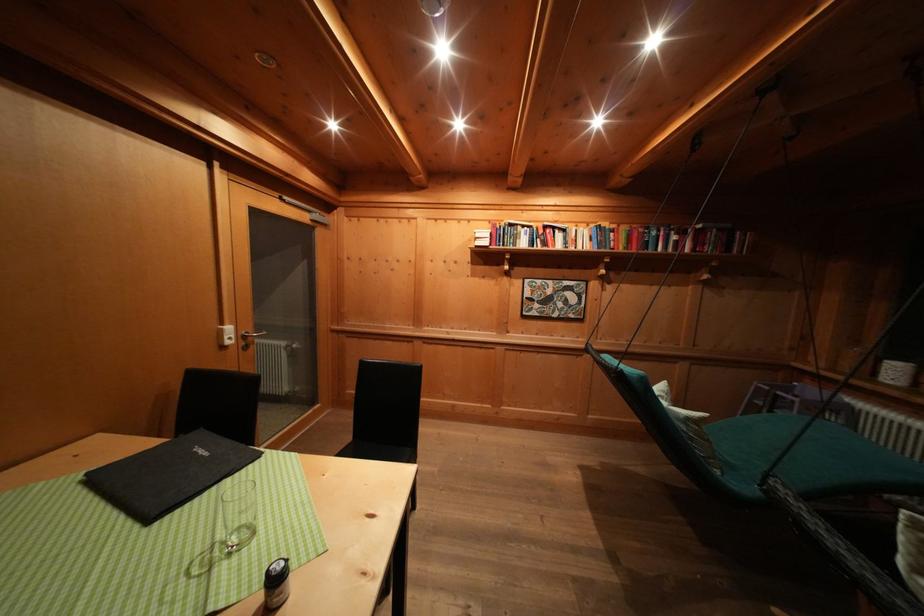
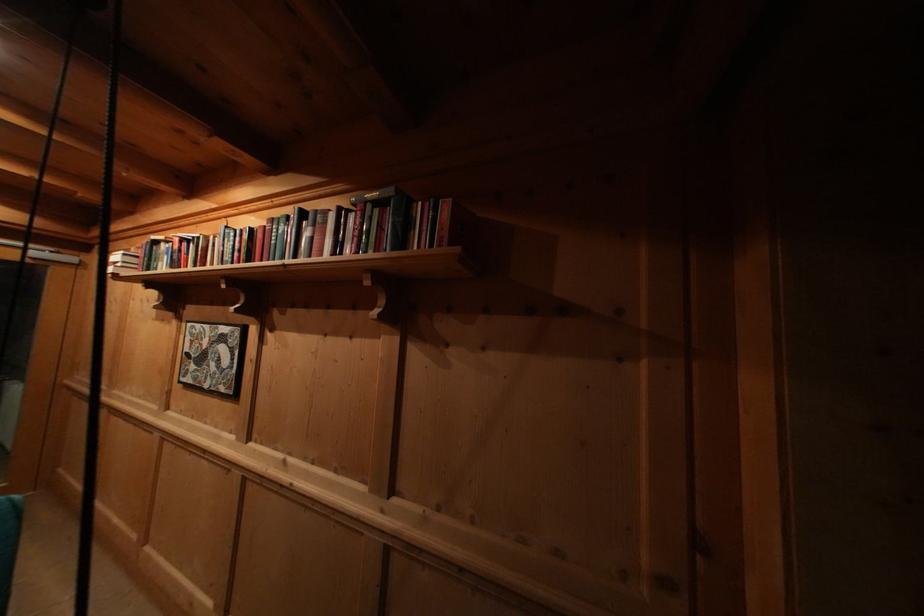
Which direction would the cameraman need to move to produce the second image?

The movement direction of the cameraman is right, forward.